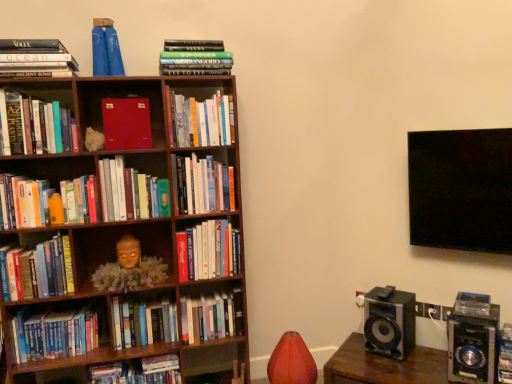
You are a GUI agent. You are given a task and a screenshot of the screen. Output one action in this format:
    pyautogui.click(x=<x>, y=<y>)
    Task: Click on the vacant area that is in front of metallic silver speaker at lower right, positioned as the second speaker in right-to-left order
    Image resolution: width=512 pixels, height=384 pixels.
    Given the screenshot: What is the action you would take?
    pyautogui.click(x=390, y=367)